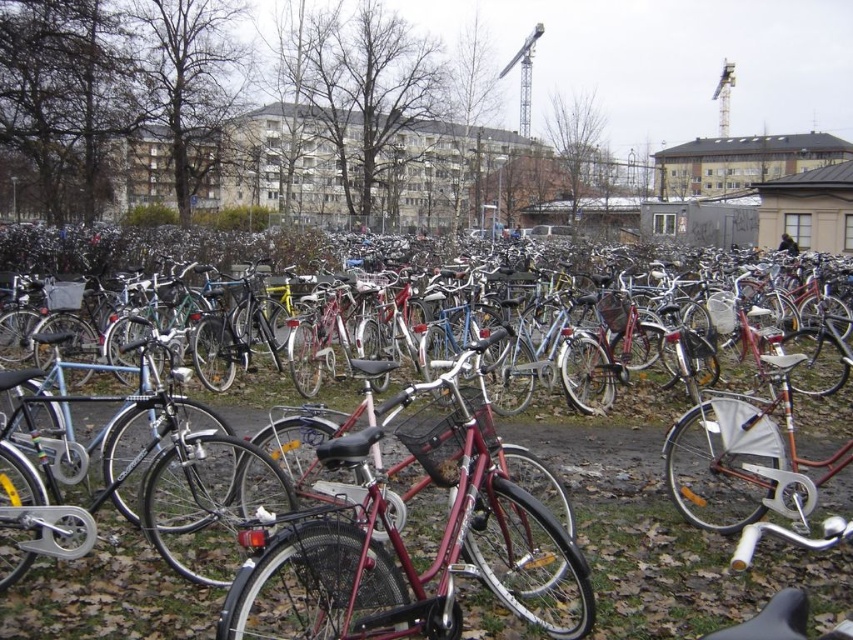
Who is higher up, metallic bicycles at center or shiny metallic bicycle at center?

shiny metallic bicycle at center

The height and width of the screenshot is (640, 853). What are the coordinates of `metallic bicycles at center` in the screenshot? It's located at (659, 525).

Where is `metallic bicycles at center`? The image size is (853, 640). metallic bicycles at center is located at coordinates (659, 525).

Is shiny red bicycle at center behind shiny metallic bicycle at center?

That is False.

Does point (316, 564) come farther from viewer compared to point (120, 230)?

No, (316, 564) is in front of (120, 230).

Identify the location of shiny red bicycle at center. This screenshot has height=640, width=853. (405, 547).

I want to click on shiny red bicycle at center, so click(405, 547).

Which is more to the left, metallic bicycles at center or shiny red bicycle at center?

shiny red bicycle at center is more to the left.

Can you confirm if metallic bicycles at center is bigger than shiny red bicycle at center?

Actually, metallic bicycles at center might be smaller than shiny red bicycle at center.

Identify the location of metallic bicycles at center. (659, 525).

What are the coordinates of `metallic bicycles at center` in the screenshot? It's located at (659, 525).